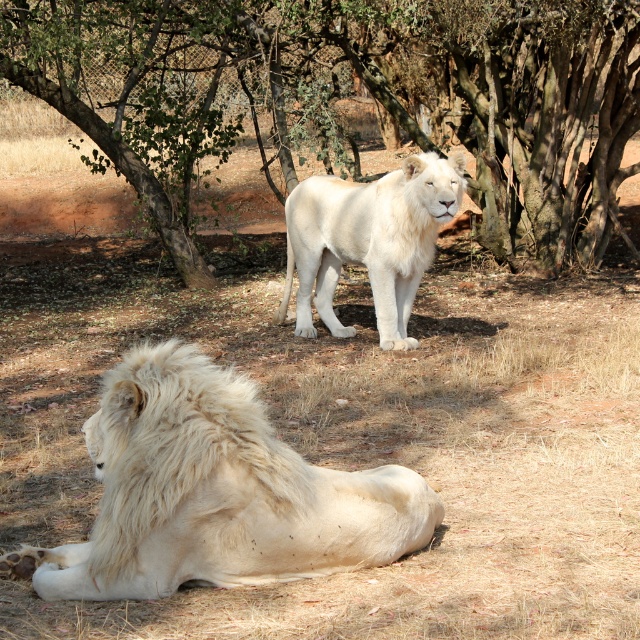
Can you confirm if fuzzy white lion at lower left is bigger than white fluffy lion at center?

Incorrect, fuzzy white lion at lower left is not larger than white fluffy lion at center.

You are a GUI agent. You are given a task and a screenshot of the screen. Output one action in this format:
    pyautogui.click(x=<x>, y=<y>)
    Task: Click on the fuzzy white lion at lower left
    The width and height of the screenshot is (640, 640).
    Given the screenshot: What is the action you would take?
    pyautogui.click(x=216, y=492)

Which of these two, green leafy tree at upper center or fuzzy white lion at lower left, stands shorter?

Standing shorter between the two is green leafy tree at upper center.

Is green leafy tree at upper center smaller than fuzzy white lion at lower left?

Yes.

Between point (4, 67) and point (326, 484), which one is positioned behind?

The point (4, 67) is more distant.

You are a GUI agent. You are given a task and a screenshot of the screen. Output one action in this format:
    pyautogui.click(x=<x>, y=<y>)
    Task: Click on the green leafy tree at upper center
    
    Given the screenshot: What is the action you would take?
    pyautogui.click(x=340, y=93)

Which is above, green leafy tree at upper center or white fluffy lion at center?

green leafy tree at upper center is above.

Can you confirm if green leafy tree at upper center is shorter than white fluffy lion at center?

Yes, green leafy tree at upper center is shorter than white fluffy lion at center.

You are a GUI agent. You are given a task and a screenshot of the screen. Output one action in this format:
    pyautogui.click(x=<x>, y=<y>)
    Task: Click on the green leafy tree at upper center
    
    Given the screenshot: What is the action you would take?
    pyautogui.click(x=340, y=93)